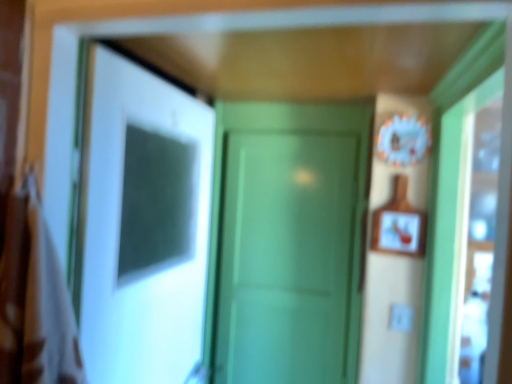
Question: Can you confirm if green matte door at center, arranged as the 1th door when viewed from the right, is positioned to the right of wooden framed picture at right?

Choices:
 (A) yes
 (B) no

Answer: (B)

Question: From the image's perspective, is green matte door at center, which is counted as the first door, starting from the back, above wooden framed picture at right?

Choices:
 (A) yes
 (B) no

Answer: (B)

Question: Is wooden framed picture at right surrounded by green matte door at center, which appears as the second door when viewed from the left?

Choices:
 (A) yes
 (B) no

Answer: (B)

Question: Is green matte door at center, which is counted as the first door, starting from the back, aimed at wooden framed picture at right?

Choices:
 (A) yes
 (B) no

Answer: (B)

Question: Considering the relative positions of green matte door at center, which is counted as the first door, starting from the back, and wooden framed picture at right in the image provided, is green matte door at center, which is counted as the first door, starting from the back, in front of wooden framed picture at right?

Choices:
 (A) yes
 (B) no

Answer: (B)

Question: Considering the positions of brown fabric laundry at left and white glossy door at center, which ranks as the second door in right-to-left order, in the image, is brown fabric laundry at left wider or thinner than white glossy door at center, which ranks as the second door in right-to-left order,?

Choices:
 (A) thin
 (B) wide

Answer: (B)

Question: Is brown fabric laundry at left in front of or behind white glossy door at center, which ranks as the 2th door in back-to-front order, in the image?

Choices:
 (A) behind
 (B) front

Answer: (B)

Question: Is point (6, 289) positioned closer to the camera than point (128, 264)?

Choices:
 (A) farther
 (B) closer

Answer: (B)

Question: Is brown fabric laundry at left to the left or to the right of white glossy door at center, which ranks as the 2th door in back-to-front order, in the image?

Choices:
 (A) left
 (B) right

Answer: (A)

Question: Based on their sizes in the image, would you say wooden framed picture at right is bigger or smaller than green matte door at center, which appears as the second door when viewed from the left?

Choices:
 (A) small
 (B) big

Answer: (A)

Question: From a real-world perspective, is wooden framed picture at right positioned above or below green matte door at center, which appears as the second door when viewed from the left?

Choices:
 (A) above
 (B) below

Answer: (A)

Question: Considering their positions, is wooden framed picture at right located in front of or behind green matte door at center, which is counted as the first door, starting from the back?

Choices:
 (A) behind
 (B) front

Answer: (B)

Question: Is point (420, 231) closer or farther from the camera than point (266, 254)?

Choices:
 (A) closer
 (B) farther

Answer: (A)

Question: Is green matte door at center, which is counted as the first door, starting from the back, bigger or smaller than brown fabric laundry at left?

Choices:
 (A) big
 (B) small

Answer: (A)

Question: From the image's perspective, is green matte door at center, which is counted as the first door, starting from the back, positioned above or below brown fabric laundry at left?

Choices:
 (A) below
 (B) above

Answer: (A)